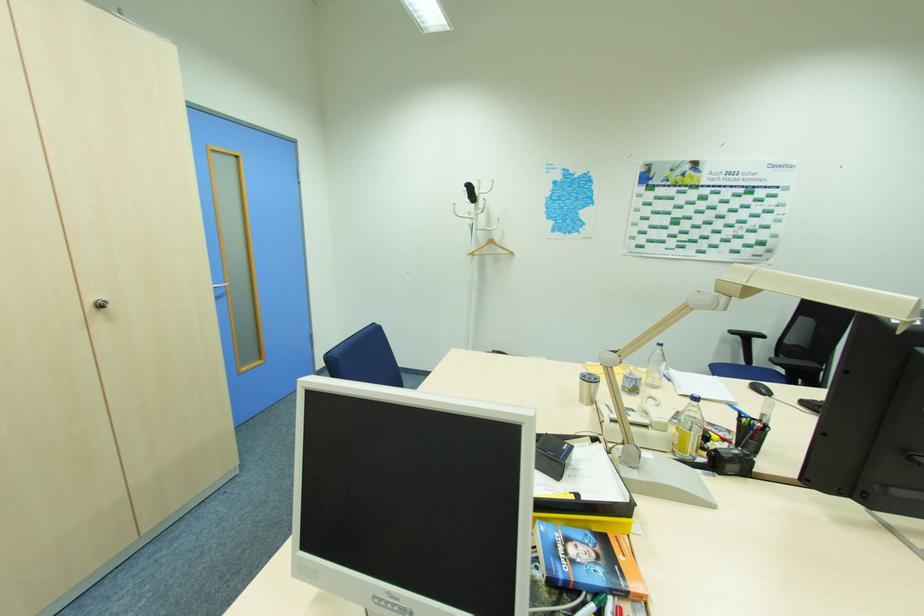
At what (x,y) coordinates should I click in order to perform the action: click on metal tumbler. Please return your answer as a coordinate pair (x, y). Looking at the image, I should click on (588, 387).